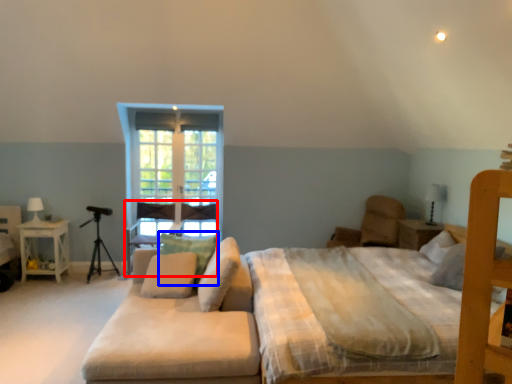
Question: Which of the following is the farthest to the observer, armchair (highlighted by a red box) or pillow (highlighted by a blue box)?

Choices:
 (A) armchair
 (B) pillow

Answer: (A)